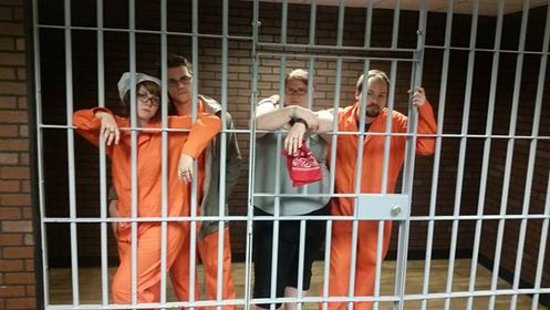
Identify the location of lock. (396, 212).